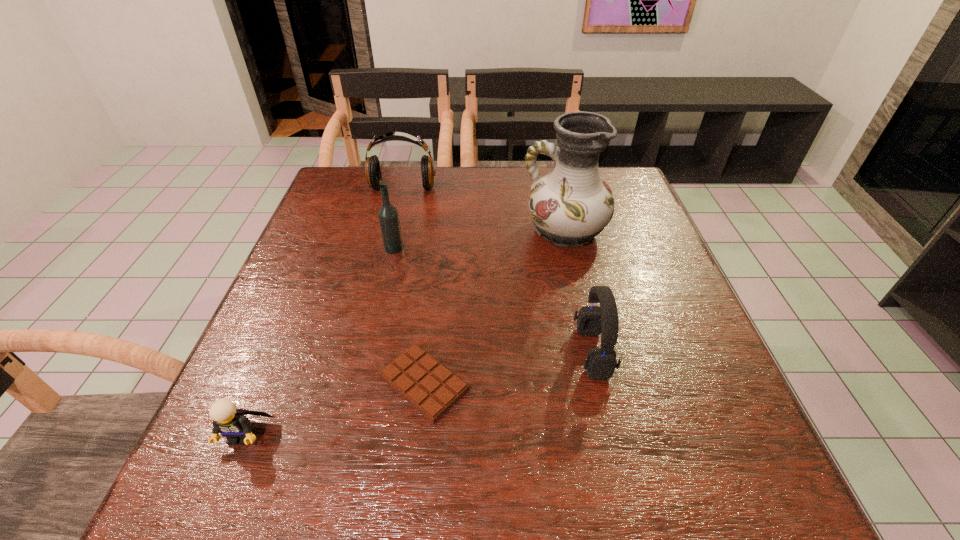
Where is `vase`? The image size is (960, 540). vase is located at coordinates (571, 205).

Find the location of `vodka`. vodka is located at coordinates (388, 216).

At what (x,y) coordinates should I click in order to perform the action: click on the farthest object. Please return your answer as a coordinate pair (x, y). The image size is (960, 540). Looking at the image, I should click on (372, 166).

Where is `the left headset`? The width and height of the screenshot is (960, 540). the left headset is located at coordinates (372, 166).

Identify the location of the right headset. The width and height of the screenshot is (960, 540). (600, 363).

Locate an element on the screen. the leftmost object is located at coordinates (232, 423).

Find the location of a particular element. The height and width of the screenshot is (540, 960). the second shortest object is located at coordinates (232, 423).

The image size is (960, 540). What are the coordinates of `the shortest object` in the screenshot? It's located at (431, 388).

Where is `vacant position located 0.150m on the left of the vase`? This screenshot has width=960, height=540. vacant position located 0.150m on the left of the vase is located at coordinates (465, 231).

At what (x,y) coordinates should I click in order to perform the action: click on vacant space located 0.090m on the left of the vodka. Please return your answer as a coordinate pair (x, y). This screenshot has height=540, width=960. Looking at the image, I should click on (348, 248).